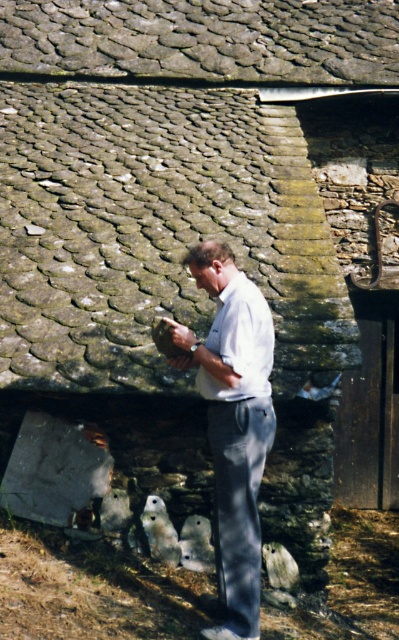
You are a fashion designer observing a man wearing a white cotton shirt at center and holding a white matte owl at lower center. Which item has a larger height?

The white cotton shirt at center has a greater height compared to the white matte owl at lower center.

You are a photographer trying to capture the man and the stone structure in a single shot. You notice two specific points in the scene marked as point 1 at coordinates (217, 452) and point 2 at coordinates (158, 509). Which point is positioned closer to your camera lens?

Point 1 at coordinates (217, 452) is closer to the camera lens than point 2 at coordinates (158, 509).